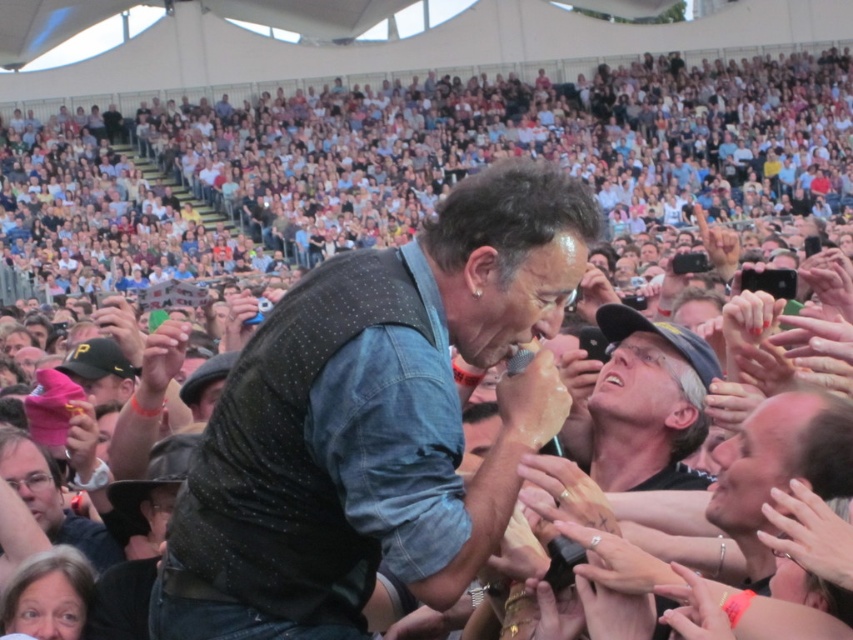
Question: Is denim vest at center smaller than gray fabric cap at center?

Choices:
 (A) yes
 (B) no

Answer: (B)

Question: Which object is farther from the camera taking this photo?

Choices:
 (A) gray fabric cap at center
 (B) denim vest at center

Answer: (A)

Question: Among these points, which one is farthest from the camera?

Choices:
 (A) (653, 412)
 (B) (323, 444)

Answer: (A)

Question: Does denim vest at center have a greater width compared to gray fabric cap at center?

Choices:
 (A) yes
 (B) no

Answer: (A)

Question: Which point is closer to the camera?

Choices:
 (A) denim vest at center
 (B) gray fabric cap at center

Answer: (A)

Question: Does denim vest at center appear over gray fabric cap at center?

Choices:
 (A) no
 (B) yes

Answer: (B)